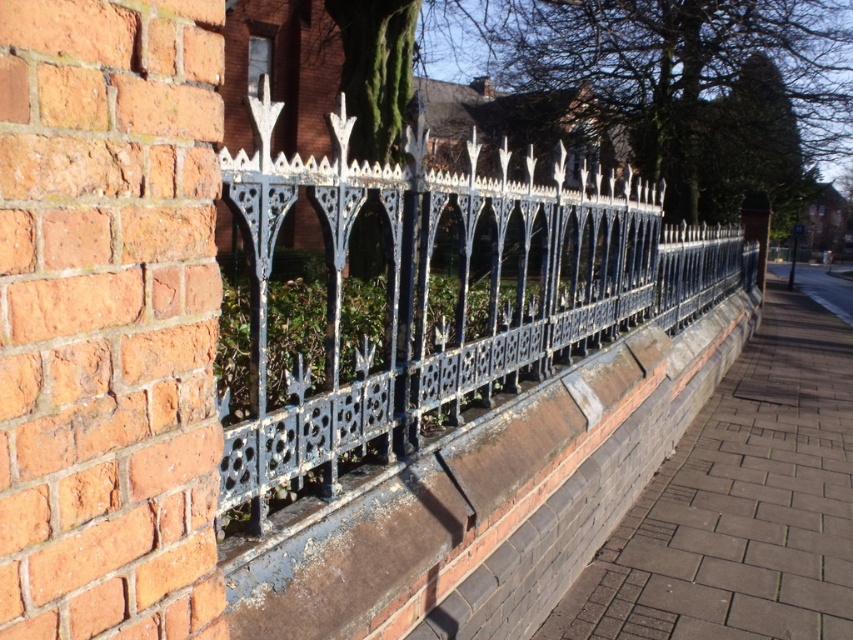
You are a delivery person with a cart that is 1.5 meters wide. You need to navigate through the space between the blue wrought iron fence at center and the black brick ledge at center. Can your cart fit through the space between them?

The distance between the blue wrought iron fence at center and the black brick ledge at center is 7.78 meters, which is significantly wider than the cart width of 1.5 meters. Therefore, the cart can easily fit through the space between them.

You are standing on the sidewalk in front of the decorative wrought iron fence. You want to place a small potted plant exactly at the center of the black brick ledge at center. According to the image, what are the coordinates where you should place the plant?

The coordinates for the black brick ledge at center are point (495, 502), so you should place the plant at those coordinates.

You are a delivery person approaching the black brick ledge at center and the gray brick pavement at lower right. Which object is closer to you as you walk towards them?

The black brick ledge at center is closer to you because it is positioned in front of the gray brick pavement at lower right.